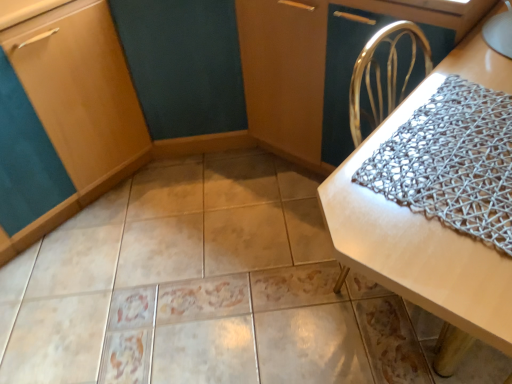
The height and width of the screenshot is (384, 512). Describe the element at coordinates (311, 63) in the screenshot. I see `metallic woven placemat at upper right` at that location.

Where is `matte wood cabinet at lower left`? The width and height of the screenshot is (512, 384). matte wood cabinet at lower left is located at coordinates (78, 105).

This screenshot has width=512, height=384. What are the coordinates of `beige glossy tile at center` in the screenshot? It's located at (185, 284).

From a real-world perspective, is matte wood cabinet at lower left positioned above or below white woven placemat at center?

From a real-world perspective, matte wood cabinet at lower left is physically above white woven placemat at center.

Does matte wood cabinet at lower left have a larger size compared to white woven placemat at center?

No.

Considering the sizes of matte wood cabinet at lower left and white woven placemat at center in the image, is matte wood cabinet at lower left wider or thinner than white woven placemat at center?

Considering their sizes, matte wood cabinet at lower left looks broader than white woven placemat at center.

Which of these two, matte wood cabinet at lower left or silver mesh blanket at right, is thinner?

Thinner between the two is silver mesh blanket at right.

Is matte wood cabinet at lower left positioned with its back to silver mesh blanket at right?

No.

Between matte wood cabinet at lower left and silver mesh blanket at right, which one has smaller size?

Smaller between the two is silver mesh blanket at right.

Would you say matte wood cabinet at lower left is inside or outside metallic woven placemat at upper right?

matte wood cabinet at lower left is located beyond the bounds of metallic woven placemat at upper right.

Find the location of a particular element. This screenshot has width=512, height=384. cabinetry in front of the metallic woven placemat at upper right is located at coordinates (78, 105).

In the scene shown: Is matte wood cabinet at lower left touching metallic woven placemat at upper right?

matte wood cabinet at lower left is not next to metallic woven placemat at upper right, and they're not touching.

From a real-world perspective, between matte wood cabinet at lower left and metallic woven placemat at upper right, who is vertically higher?

matte wood cabinet at lower left.

Considering the relative positions of metallic woven placemat at upper right and matte wood cabinet at lower left in the image provided, is metallic woven placemat at upper right to the right of matte wood cabinet at lower left from the viewer's perspective?

Indeed, metallic woven placemat at upper right is positioned on the right side of matte wood cabinet at lower left.

Is metallic woven placemat at upper right bigger or smaller than matte wood cabinet at lower left?

metallic woven placemat at upper right is bigger than matte wood cabinet at lower left.

Would you say metallic woven placemat at upper right is outside matte wood cabinet at lower left?

Yes.

From the image's perspective, which one is positioned lower, metallic woven placemat at upper right or matte wood cabinet at lower left?

matte wood cabinet at lower left.

From a real-world perspective, is silver mesh blanket at right over matte wood cabinet at lower left?

Yes.

In the scene shown: Is silver mesh blanket at right inside or outside of matte wood cabinet at lower left?

silver mesh blanket at right lies outside matte wood cabinet at lower left.

Is silver mesh blanket at right positioned far away from matte wood cabinet at lower left?

That's right, there is a large distance between silver mesh blanket at right and matte wood cabinet at lower left.

Does silver mesh blanket at right come in front of matte wood cabinet at lower left?

Yes, it is.

Does silver mesh blanket at right have a greater height compared to beige glossy tile at center?

No.

Considering the relative positions of silver mesh blanket at right and beige glossy tile at center in the image provided, is silver mesh blanket at right to the left of beige glossy tile at center from the viewer's perspective?

Incorrect, silver mesh blanket at right is not on the left side of beige glossy tile at center.

The width and height of the screenshot is (512, 384). Find the location of `blanket in front of the beige glossy tile at center`. blanket in front of the beige glossy tile at center is located at coordinates [x=452, y=162].

Considering the sizes of silver mesh blanket at right and beige glossy tile at center in the image, is silver mesh blanket at right wider or thinner than beige glossy tile at center?

silver mesh blanket at right is thinner than beige glossy tile at center.

Is metallic woven placemat at upper right far from beige glossy tile at center?

They are positioned close to each other.

Relative to beige glossy tile at center, is metallic woven placemat at upper right in front or behind?

Visually, metallic woven placemat at upper right is located behind beige glossy tile at center.

Which is less distant, (x=468, y=31) or (x=167, y=220)?

Clearly, point (x=468, y=31) is closer to the camera than point (x=167, y=220).

Can we say metallic woven placemat at upper right lies outside beige glossy tile at center?

metallic woven placemat at upper right lies outside beige glossy tile at center's area.

You are a GUI agent. You are given a task and a screenshot of the screen. Output one action in this format:
    pyautogui.click(x=<x>, y=<y>)
    Task: Click on the cabinetry that appears above the white woven placemat at center (from a real-world perspective)
    Image resolution: width=512 pixels, height=384 pixels.
    Given the screenshot: What is the action you would take?
    pyautogui.click(x=78, y=105)

You are a GUI agent. You are given a task and a screenshot of the screen. Output one action in this format:
    pyautogui.click(x=<x>, y=<y>)
    Task: Click on the blanket in front of the matte wood cabinet at lower left
    The width and height of the screenshot is (512, 384).
    Given the screenshot: What is the action you would take?
    pyautogui.click(x=452, y=162)

From the image, which object appears to be farther from white woven placemat at center, metallic woven placemat at upper right or silver mesh blanket at right?

The object further to white woven placemat at center is metallic woven placemat at upper right.

Based on their spatial positions, is silver mesh blanket at right or metallic woven placemat at upper right closer to beige glossy tile at center?

metallic woven placemat at upper right lies closer to beige glossy tile at center than the other object.

Looking at the image, which one is located closer to metallic woven placemat at upper right, beige glossy tile at center or white woven placemat at center?

white woven placemat at center.

When comparing their distances from silver mesh blanket at right, does matte wood cabinet at lower left or beige glossy tile at center seem closer?

Answer: Among the two, beige glossy tile at center is located nearer to silver mesh blanket at right.

When comparing their distances from beige glossy tile at center, does white woven placemat at center or matte wood cabinet at lower left seem further?

Among the two, white woven placemat at center is located further to beige glossy tile at center.

When comparing their distances from beige glossy tile at center, does metallic woven placemat at upper right or white woven placemat at center seem further?

white woven placemat at center lies further to beige glossy tile at center than the other object.

Estimate the real-world distances between objects in this image. Which object is further from white woven placemat at center, metallic woven placemat at upper right or beige glossy tile at center?

beige glossy tile at center.

In the scene shown: Looking at the image, which one is located further to white woven placemat at center, matte wood cabinet at lower left or silver mesh blanket at right?

The object further to white woven placemat at center is matte wood cabinet at lower left.

You are a GUI agent. You are given a task and a screenshot of the screen. Output one action in this format:
    pyautogui.click(x=<x>, y=<y>)
    Task: Click on the blanket between matte wood cabinet at lower left and metallic woven placemat at upper right from left to right
    This screenshot has height=384, width=512.
    Given the screenshot: What is the action you would take?
    pyautogui.click(x=452, y=162)

Where is `dresser between matte wood cabinet at lower left and white woven placemat at center in the horizontal direction`? The image size is (512, 384). dresser between matte wood cabinet at lower left and white woven placemat at center in the horizontal direction is located at coordinates (311, 63).

The height and width of the screenshot is (384, 512). Find the location of `ceramic tile between matte wood cabinet at lower left and metallic woven placemat at upper right`. ceramic tile between matte wood cabinet at lower left and metallic woven placemat at upper right is located at coordinates (185, 284).

Identify the location of ceramic tile between matte wood cabinet at lower left and white woven placemat at center from left to right. This screenshot has height=384, width=512. (185, 284).